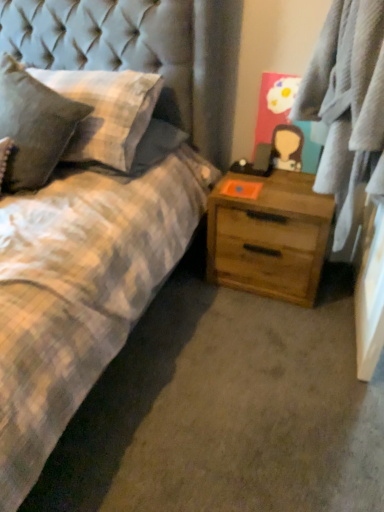
Question: Could light brown wood chest of drawers at center-right be considered to be inside textured gray pillow at left, marked as the 2th pillow in a left-to-right arrangement?

Choices:
 (A) no
 (B) yes

Answer: (A)

Question: From a real-world perspective, is textured gray pillow at left, marked as the 2th pillow in a left-to-right arrangement, located beneath light brown wood chest of drawers at center-right?

Choices:
 (A) yes
 (B) no

Answer: (B)

Question: From a real-world perspective, is textured gray pillow at left, which appears as the first pillow when viewed from the right, physically above light brown wood chest of drawers at center-right?

Choices:
 (A) no
 (B) yes

Answer: (B)

Question: Can you confirm if textured gray pillow at left, which appears as the first pillow when viewed from the right, is positioned to the left of light brown wood chest of drawers at center-right?

Choices:
 (A) yes
 (B) no

Answer: (A)

Question: From the image's perspective, would you say textured gray pillow at left, marked as the 2th pillow in a left-to-right arrangement, is positioned over light brown wood chest of drawers at center-right?

Choices:
 (A) no
 (B) yes

Answer: (B)

Question: Does textured gray pillow at left, which appears as the first pillow when viewed from the right, have a greater width compared to light brown wood chest of drawers at center-right?

Choices:
 (A) yes
 (B) no

Answer: (A)

Question: Is plaid fabric at right taller than light brown wood chest of drawers at center-right?

Choices:
 (A) no
 (B) yes

Answer: (B)

Question: Is plaid fabric at right oriented away from light brown wood chest of drawers at center-right?

Choices:
 (A) yes
 (B) no

Answer: (B)

Question: Considering the relative positions of plaid fabric at right and light brown wood chest of drawers at center-right in the image provided, is plaid fabric at right to the left of light brown wood chest of drawers at center-right from the viewer's perspective?

Choices:
 (A) no
 (B) yes

Answer: (A)

Question: Would you say plaid fabric at right contains light brown wood chest of drawers at center-right?

Choices:
 (A) no
 (B) yes

Answer: (A)

Question: Can you confirm if plaid fabric at right is smaller than light brown wood chest of drawers at center-right?

Choices:
 (A) no
 (B) yes

Answer: (A)

Question: From a real-world perspective, is plaid fabric at right located beneath light brown wood chest of drawers at center-right?

Choices:
 (A) no
 (B) yes

Answer: (A)

Question: Does light brown wood chest of drawers at center-right come behind plaid fabric pillow at left, marked as the first pillow in a left-to-right arrangement?

Choices:
 (A) no
 (B) yes

Answer: (B)